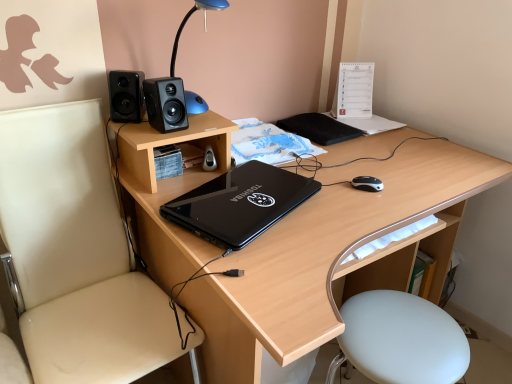
Question: Looking at the image, does black matte speaker at upper left, arranged as the 2th speaker when viewed from the right, seem bigger or smaller compared to black matte notepad at upper right?

Choices:
 (A) big
 (B) small

Answer: (B)

Question: Does point (128, 84) appear closer or farther from the camera than point (297, 130)?

Choices:
 (A) closer
 (B) farther

Answer: (A)

Question: Which object is positioned closest to the beige leather chair at left?

Choices:
 (A) wooden desk at center
 (B) blue glossy table lamp at upper center
 (C) black matte notepad at upper right
 (D) white leather bar stool at lower right
 (E) black plastic mouse at right

Answer: (A)

Question: Which is nearer to the black matte notepad at upper right?

Choices:
 (A) black matte speaker at upper center, arranged as the 2th speaker when viewed from the left
 (B) black glossy laptop at center
 (C) beige leather chair at left
 (D) black plastic mouse at right
 (E) wooden desk at center

Answer: (D)